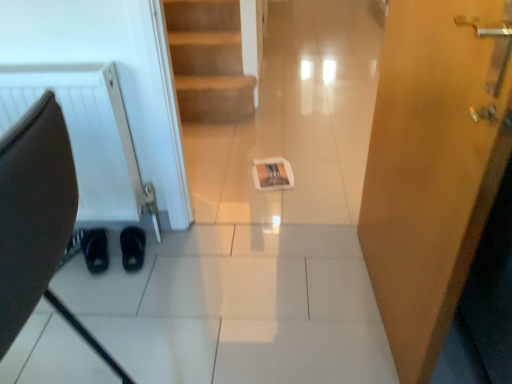
The height and width of the screenshot is (384, 512). In order to click on free location in front of matte paper magazine at center in this screenshot , I will do `click(276, 206)`.